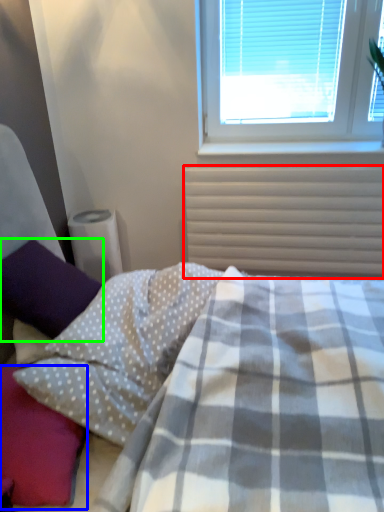
Question: Which is nearer to the radiator (highlighted by a red box)? pillow (highlighted by a blue box) or pillow (highlighted by a green box).

Choices:
 (A) pillow
 (B) pillow

Answer: (B)